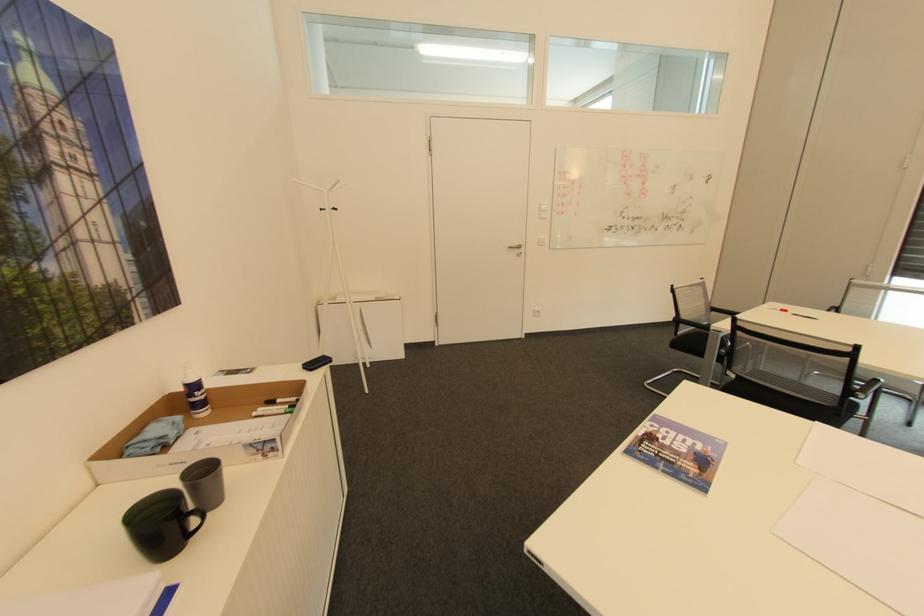
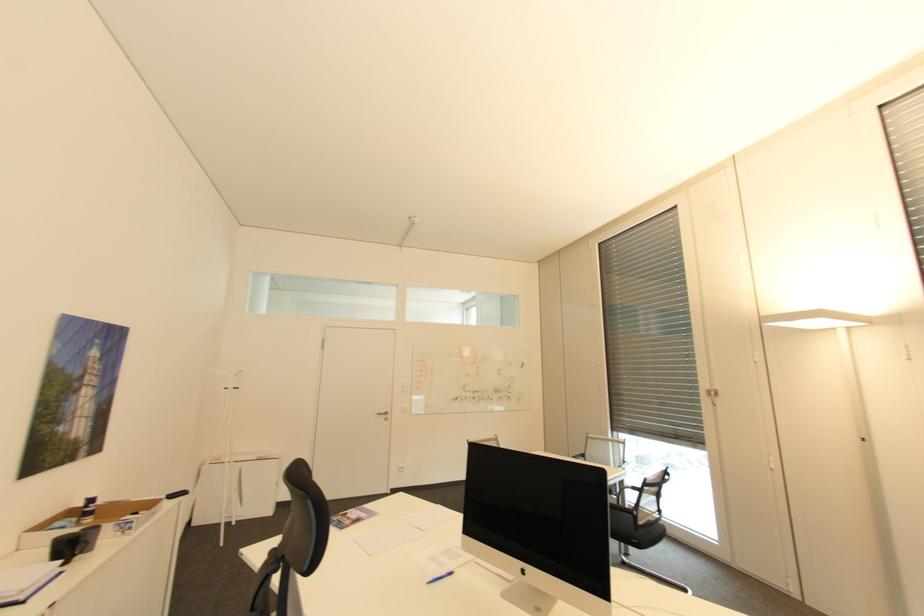
The images are taken continuously from a first-person perspective. In which direction are you moving?

The cameraman walked toward right, backward.